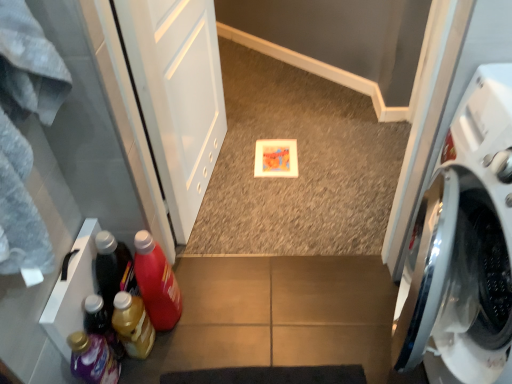
Question: Is translucent plastic bottle at lower left, which is the second bottle from left to right, turned away from matte plastic bottle at lower left, positioned as the fourth bottle in left-to-right order?

Choices:
 (A) no
 (B) yes

Answer: (A)

Question: From the image's perspective, would you say translucent plastic bottle at lower left, the 3th bottle from the right, is shown under matte plastic bottle at lower left, positioned as the fourth bottle in left-to-right order?

Choices:
 (A) yes
 (B) no

Answer: (A)

Question: From the image's perspective, is translucent plastic bottle at lower left, the 3th bottle from the right, over matte plastic bottle at lower left, positioned as the fourth bottle in left-to-right order?

Choices:
 (A) yes
 (B) no

Answer: (B)

Question: Does translucent plastic bottle at lower left, the 3th bottle from the right, have a greater height compared to matte plastic bottle at lower left, positioned as the fourth bottle in left-to-right order?

Choices:
 (A) yes
 (B) no

Answer: (B)

Question: Is translucent plastic bottle at lower left, which is the second bottle from left to right, positioned beyond the bounds of matte plastic bottle at lower left, positioned as the fourth bottle in left-to-right order?

Choices:
 (A) yes
 (B) no

Answer: (A)

Question: Looking at their shapes, would you say matte plastic bottle at lower left, positioned as the fourth bottle in left-to-right order, is wider or thinner than white glossy screen door at upper left?

Choices:
 (A) wide
 (B) thin

Answer: (A)

Question: From the image's perspective, is matte plastic bottle at lower left, which is counted as the 1th bottle, starting from the right, above or below white glossy screen door at upper left?

Choices:
 (A) below
 (B) above

Answer: (A)

Question: Is matte plastic bottle at lower left, which is counted as the 1th bottle, starting from the right, in front of or behind white glossy screen door at upper left in the image?

Choices:
 (A) front
 (B) behind

Answer: (B)

Question: Based on their positions, is matte plastic bottle at lower left, which is counted as the 1th bottle, starting from the right, located to the left or right of white glossy screen door at upper left?

Choices:
 (A) left
 (B) right

Answer: (A)

Question: Considering the positions of point (152, 274) and point (98, 364), is point (152, 274) closer or farther from the camera than point (98, 364)?

Choices:
 (A) farther
 (B) closer

Answer: (A)

Question: Looking at their shapes, would you say matte plastic bottle at lower left, positioned as the fourth bottle in left-to-right order, is wider or thinner than translucent plastic detergent at lower left, which ranks as the 4th bottle in right-to-left order?

Choices:
 (A) thin
 (B) wide

Answer: (B)

Question: Visually, is matte plastic bottle at lower left, which is counted as the 1th bottle, starting from the right, positioned to the left or to the right of translucent plastic detergent at lower left, which ranks as the 4th bottle in right-to-left order?

Choices:
 (A) right
 (B) left

Answer: (A)

Question: Considering their positions, is matte plastic bottle at lower left, which is counted as the 1th bottle, starting from the right, located in front of or behind translucent plastic detergent at lower left, acting as the 1th bottle starting from the left?

Choices:
 (A) front
 (B) behind

Answer: (B)

Question: In terms of size, does matte plastic bottle at lower left, positioned as the fourth bottle in left-to-right order, appear bigger or smaller than white glossy washing machine at right?

Choices:
 (A) small
 (B) big

Answer: (A)

Question: From the image's perspective, is matte plastic bottle at lower left, positioned as the fourth bottle in left-to-right order, located above or below white glossy washing machine at right?

Choices:
 (A) above
 (B) below

Answer: (B)